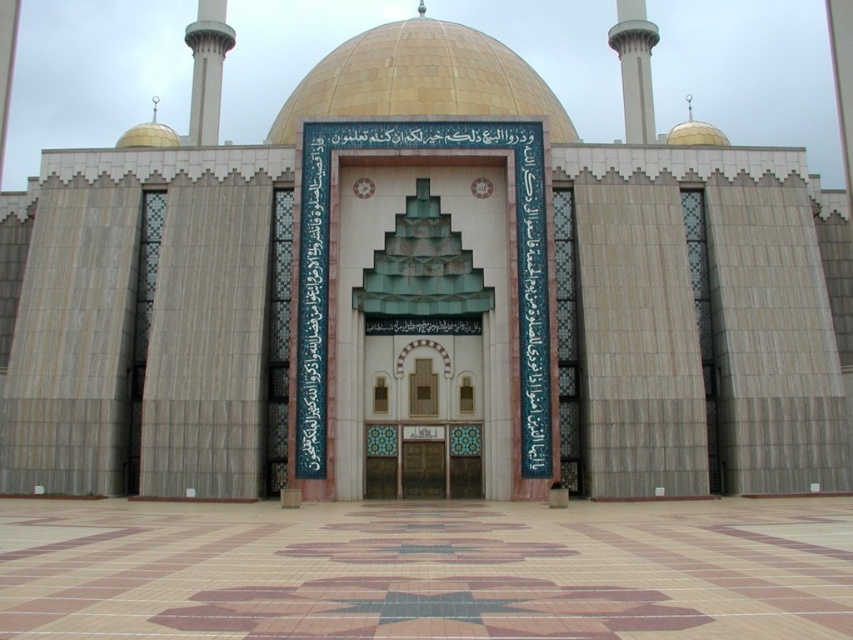
You are standing in front of the mosque and want to take a photo of the white concrete minaret at upper center. Where should you position yourself to capture it in the center of your camera viewfinder?

To center the white concrete minaret at upper center in your camera viewfinder, position yourself directly in front of the mosque at the point corresponding to its 2D coordinates at approximately 0.106 on the horizontal axis and 0.744 on the vertical axis.

Based on the photo, you are planning to install a new lighting fixture on the mosque facade. The fixture needs to be placed above the gold mosaic dome at center and the white marble minaret at upper left. Which object should the lighting fixture be placed above to ensure it is higher?

The gold mosaic dome at center is taller than the white marble minaret at upper left, so the lighting fixture should be placed above the gold mosaic dome at center to ensure it is higher.